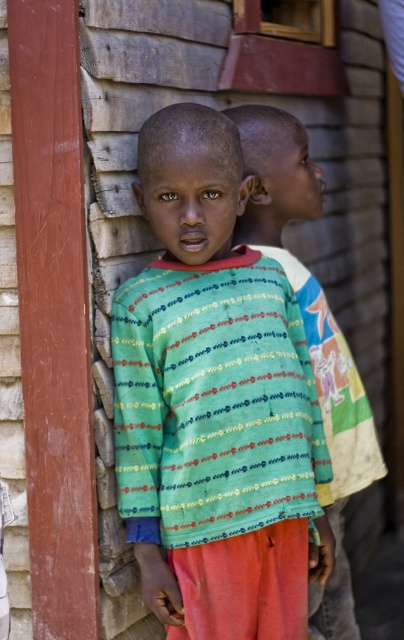
Question: Which object appears closest to the camera in this image?

Choices:
 (A) multicolored fabric shirt at center
 (B) multicolored printed shirt at center

Answer: (B)

Question: Is multicolored printed shirt at center smaller than multicolored fabric shirt at center?

Choices:
 (A) yes
 (B) no

Answer: (A)

Question: Can you confirm if multicolored printed shirt at center is smaller than multicolored fabric shirt at center?

Choices:
 (A) yes
 (B) no

Answer: (A)

Question: Which object appears farthest from the camera in this image?

Choices:
 (A) multicolored fabric shirt at center
 (B) multicolored printed shirt at center

Answer: (A)

Question: Considering the relative positions of multicolored printed shirt at center and multicolored fabric shirt at center in the image provided, where is multicolored printed shirt at center located with respect to multicolored fabric shirt at center?

Choices:
 (A) left
 (B) right

Answer: (A)